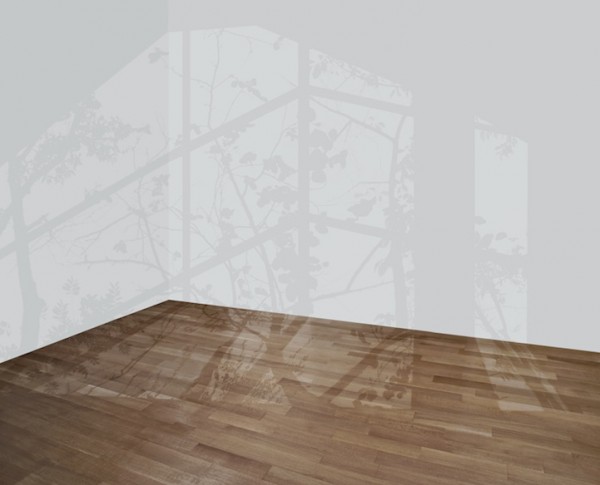
Identify the location of hardwood floor. The width and height of the screenshot is (600, 485). (266, 450).